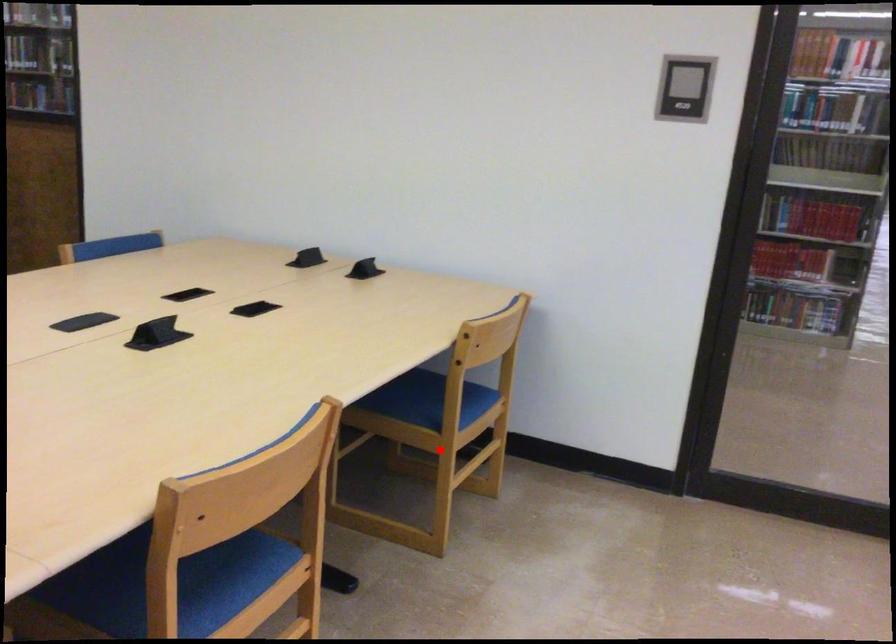
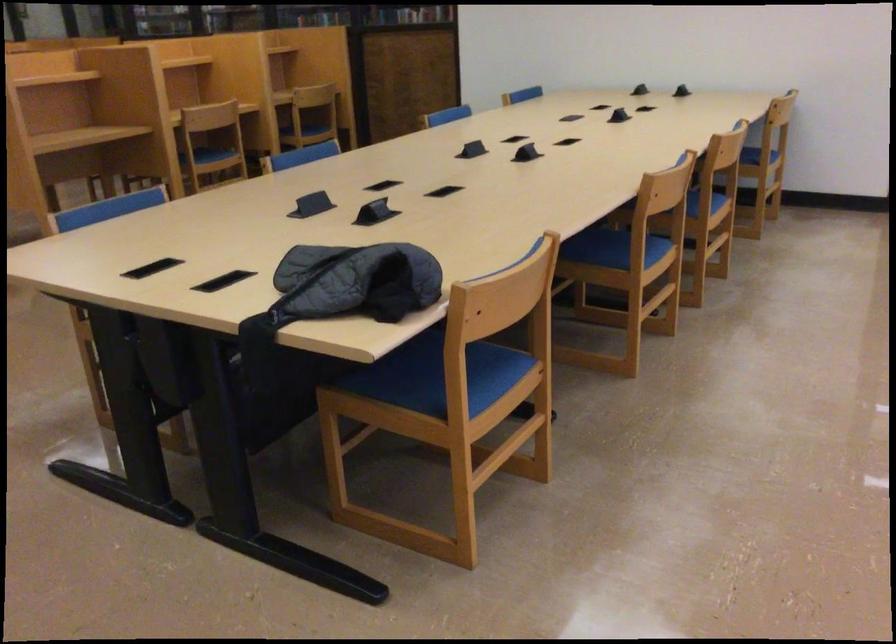
Find the pixel in the second image that matches the highlighted location in the first image.

(760, 169)